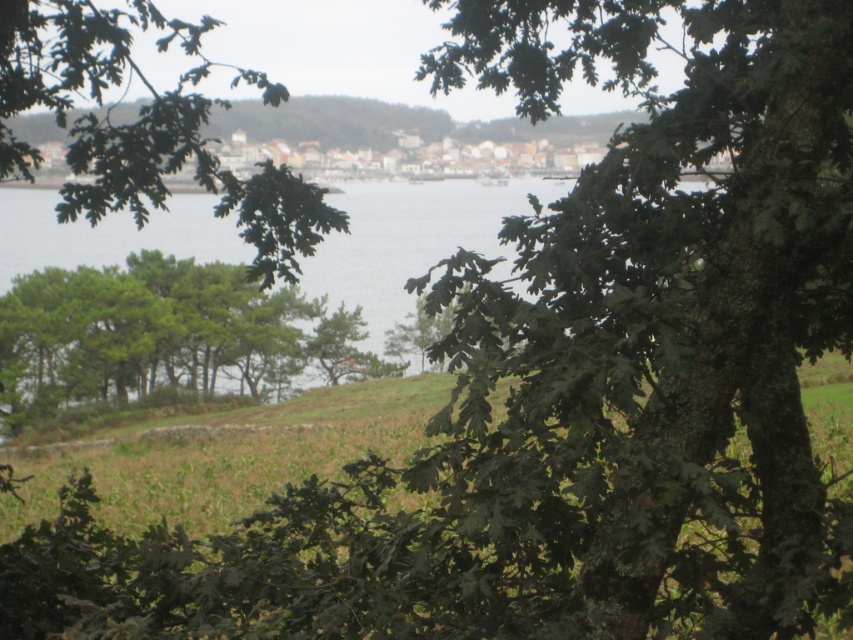
Is green leafy tree at center to the left of green water at center from the viewer's perspective?

Correct, you'll find green leafy tree at center to the left of green water at center.

Between point (158, 49) and point (144, 234), which one is positioned in front?

Point (158, 49)

Find the location of `green leafy tree at center`. green leafy tree at center is located at coordinates (144, 128).